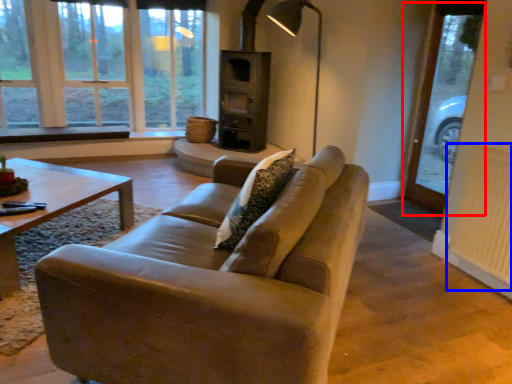
Question: Which object appears closest to the camera in this image, screen door (highlighted by a red box) or radiator (highlighted by a blue box)?

Choices:
 (A) screen door
 (B) radiator

Answer: (B)